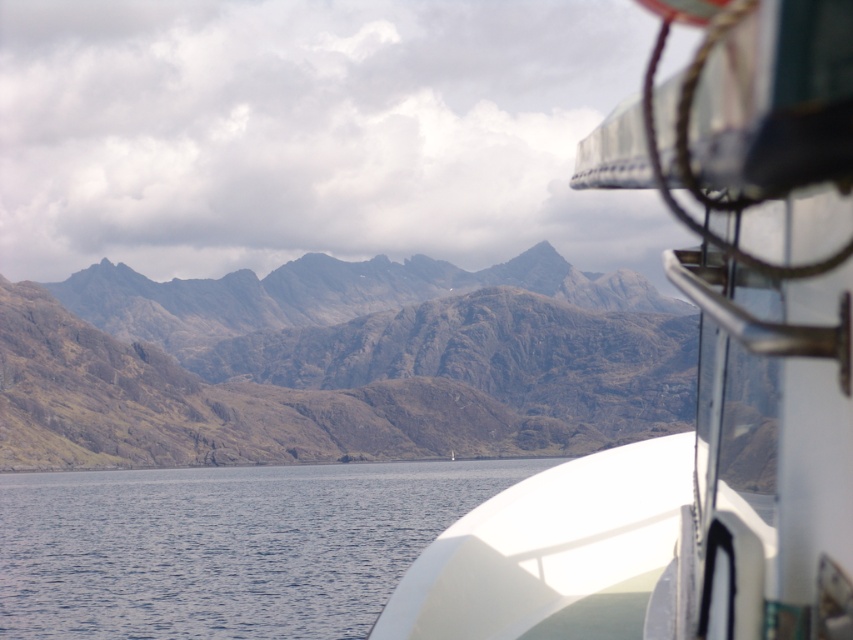
Is brown rough mountain at center to the left of blue water at lower left from the viewer's perspective?

Yes, brown rough mountain at center is to the left of blue water at lower left.

Identify the location of brown rough mountain at center. (338, 364).

Which is in front, point (784, 492) or point (381, 348)?

Positioned in front is point (784, 492).

Can you confirm if white glossy boat at upper right is shorter than brown rough mountain at center?

Yes, white glossy boat at upper right is shorter than brown rough mountain at center.

The image size is (853, 640). Describe the element at coordinates (701, 372) in the screenshot. I see `white glossy boat at upper right` at that location.

Identify the location of white glossy boat at upper right. (701, 372).

Is white glossy boat at upper right positioned behind blue water at lower left?

No, it is in front of blue water at lower left.

Find the location of a particular element. Image resolution: width=853 pixels, height=640 pixels. white glossy boat at upper right is located at coordinates (701, 372).